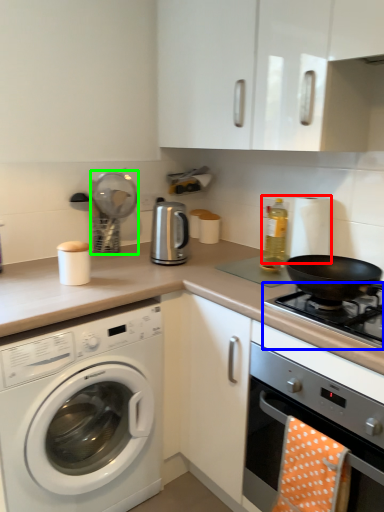
Question: Which object is positioned closest to appliance (highlighted by a red box)? Select from gas stove (highlighted by a blue box) and appliance (highlighted by a green box).

Choices:
 (A) gas stove
 (B) appliance

Answer: (A)